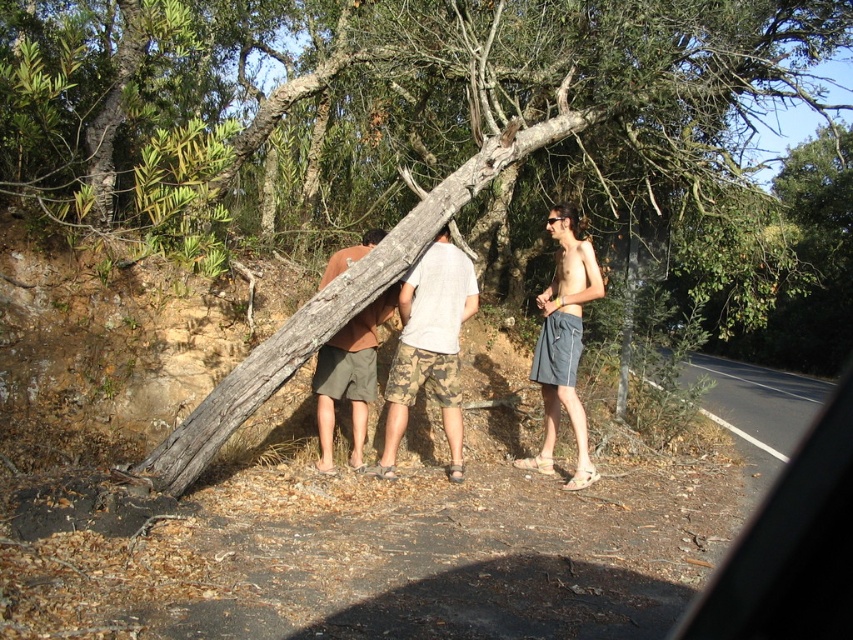
Consider the image. Which of these two, camouflage shorts at center or gray fabric shorts at right, stands shorter?

Standing shorter between the two is camouflage shorts at center.

Which is below, camouflage shorts at center or gray fabric shorts at right?

gray fabric shorts at right is lower down.

Does point (439, 236) lie behind point (579, 445)?

That is False.

Find the location of `camouflage shorts at center`. camouflage shorts at center is located at coordinates (430, 348).

Is camo shorts at center shorter than brown cotton shorts at center?

No, camo shorts at center is not shorter than brown cotton shorts at center.

Does camo shorts at center appear over brown cotton shorts at center?

Indeed, camo shorts at center is positioned over brown cotton shorts at center.

Find the location of a particular element. This screenshot has height=640, width=853. camo shorts at center is located at coordinates (428, 348).

What are the coordinates of `camo shorts at center` in the screenshot? It's located at (428, 348).

Who is more forward, (x=554, y=304) or (x=361, y=243)?

Point (x=554, y=304)

Is point (567, 218) less distant than point (358, 451)?

No.

Does point (564, 381) lie behind point (334, 356)?

No, it is not.

You are a GUI agent. You are given a task and a screenshot of the screen. Output one action in this format:
    pyautogui.click(x=<x>, y=<y>)
    Task: Click on the gray fabric shorts at right
    
    Given the screenshot: What is the action you would take?
    pyautogui.click(x=563, y=342)